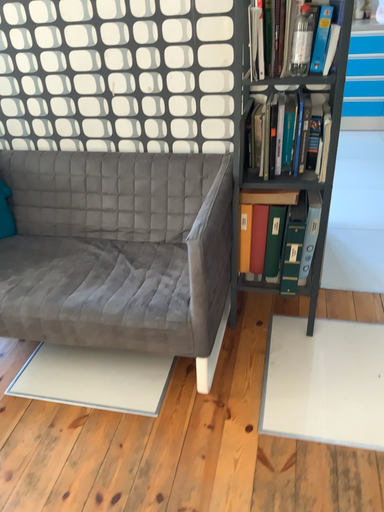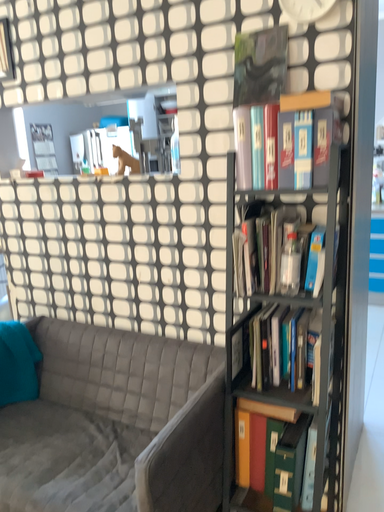
Question: How did the camera likely rotate when shooting the video?

Choices:
 (A) rotated downward
 (B) rotated upward

Answer: (B)